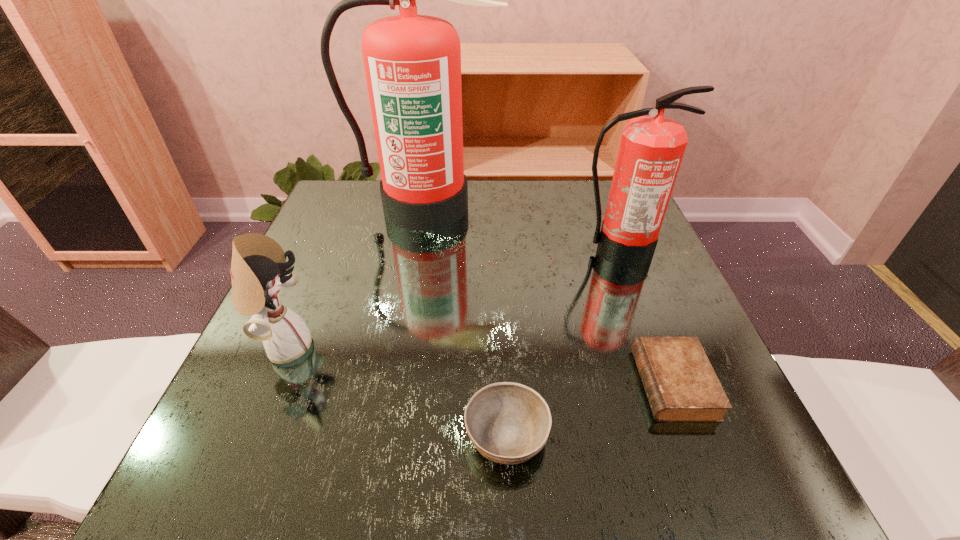
Find the location of a particular element. The height and width of the screenshot is (540, 960). object that is at the far left corner is located at coordinates (412, 62).

At what (x,y) coordinates should I click in order to perform the action: click on free space at the far edge of the desktop. Please return your answer as a coordinate pair (x, y). The image size is (960, 540). Looking at the image, I should click on (x=555, y=205).

Find the location of a particular element. vacant space at the left edge of the desktop is located at coordinates pos(347,299).

Image resolution: width=960 pixels, height=540 pixels. In order to click on vacant space at the right edge of the desktop in this screenshot , I will do `click(607, 281)`.

Find the location of a particular element. The height and width of the screenshot is (540, 960). free space at the far right corner of the desktop is located at coordinates (602, 191).

I want to click on empty space that is in between the bowl and the shortest object, so click(589, 409).

Find the location of a particular element. Image resolution: width=960 pixels, height=540 pixels. empty space between the diary and the bowl is located at coordinates (589, 409).

You are a GUI agent. You are given a task and a screenshot of the screen. Output one action in this format:
    pyautogui.click(x=<x>, y=<y>)
    Task: Click on the free space between the farther fire extinguisher and the diary
    
    Given the screenshot: What is the action you would take?
    pyautogui.click(x=550, y=295)

The image size is (960, 540). In order to click on free space between the second shortest object and the shortest object in this screenshot , I will do `click(589, 409)`.

Where is `vacant area that lies between the farthest object and the shortest object`? vacant area that lies between the farthest object and the shortest object is located at coordinates (550, 295).